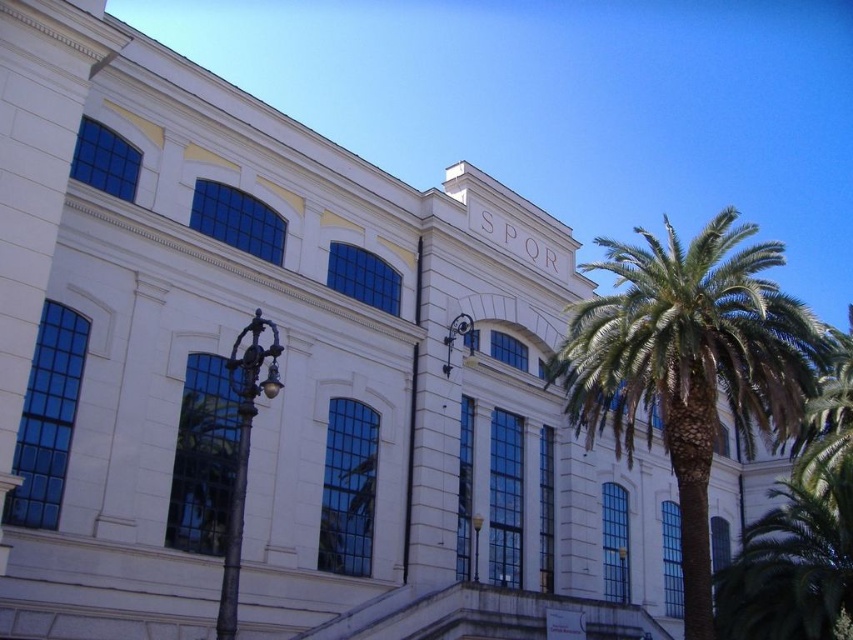
You are standing in front of the grand classical building and want to take a photo of the white glossy clock at upper center without any obstructions. Is the green leafy palm tree at right blocking your view?

The green leafy palm tree at right is in front of the white glossy clock at upper center, so it would block your view of the clock.

You are standing in front of the classical building and want to place a new decorative item between the green leafy palm tree at right and the white glossy clock at upper center. Based on their positions, where should you place the item to ensure it is between them?

The green leafy palm tree at right is positioned on the right side of the white glossy clock at upper center, so placing the new decorative item to the left of the palm tree and to the right of the clock would position it between them.